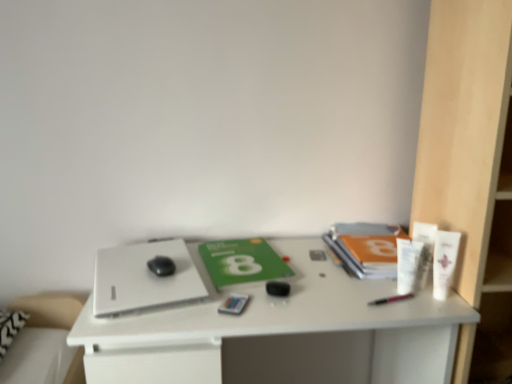
Find the location of a particular element. free spot to the right of black plastic pen at center, arranged as the 1th stationery when viewed from the right is located at coordinates (430, 298).